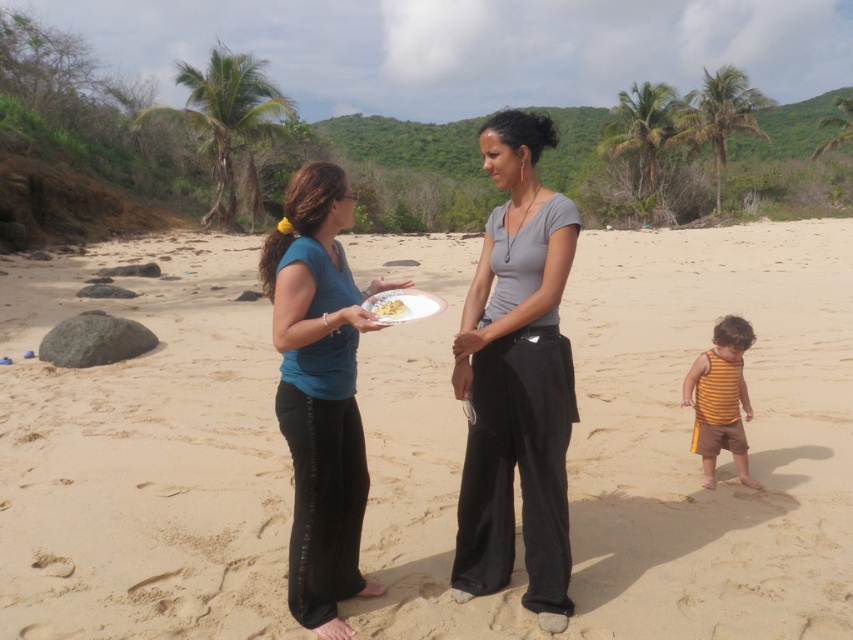
Which is below, striped cotton tank top at lower right or white matte plate at center?

striped cotton tank top at lower right is lower down.

Is striped cotton tank top at lower right shorter than white matte plate at center?

No, striped cotton tank top at lower right is not shorter than white matte plate at center.

Identify the location of striped cotton tank top at lower right. Image resolution: width=853 pixels, height=640 pixels. (720, 397).

Is gray matte shirt at center further to camera compared to blue matte shirt at center?

Yes, gray matte shirt at center is behind blue matte shirt at center.

Is gray matte shirt at center in front of blue matte shirt at center?

No, it is not.

Describe the element at coordinates (515, 380) in the screenshot. I see `gray matte shirt at center` at that location.

Locate an element on the screen. gray matte shirt at center is located at coordinates (515, 380).

Which is above, gray matte shirt at center or striped cotton tank top at lower right?

Positioned higher is gray matte shirt at center.

Is gray matte shirt at center thinner than striped cotton tank top at lower right?

Incorrect, gray matte shirt at center's width is not less than striped cotton tank top at lower right's.

What do you see at coordinates (515, 380) in the screenshot? I see `gray matte shirt at center` at bounding box center [515, 380].

You are a GUI agent. You are given a task and a screenshot of the screen. Output one action in this format:
    pyautogui.click(x=<x>, y=<y>)
    Task: Click on the gray matte shirt at center
    This screenshot has width=853, height=640.
    Given the screenshot: What is the action you would take?
    pyautogui.click(x=515, y=380)